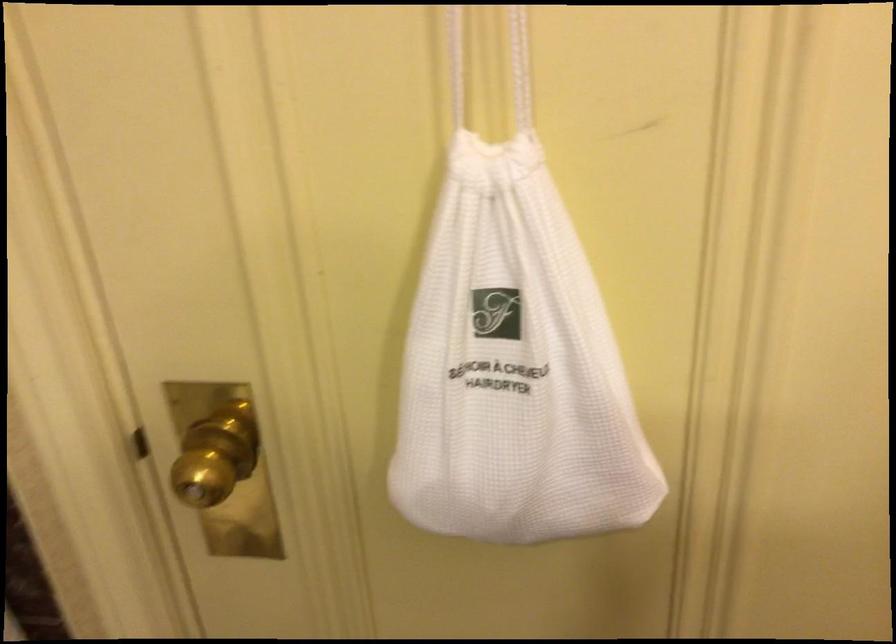
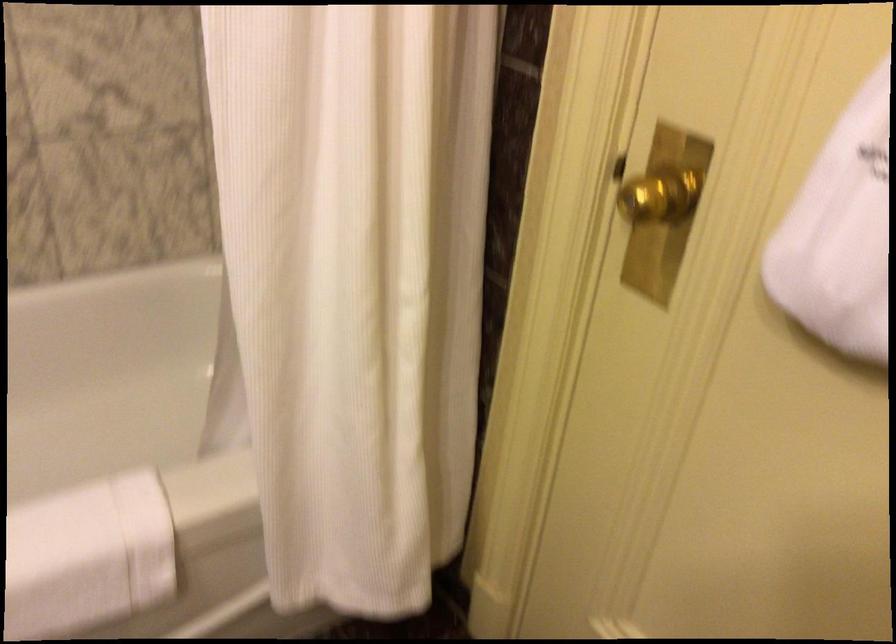
Locate, in the second image, the point that corresponds to point (218, 466) in the first image.

(657, 194)